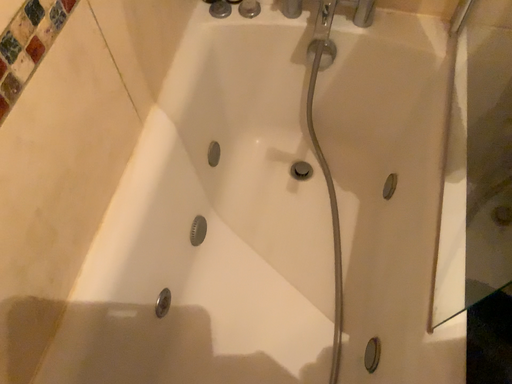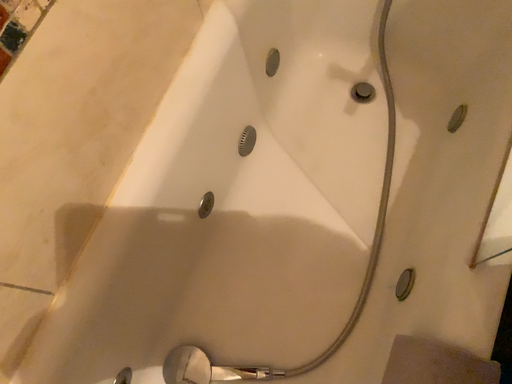
Question: Which way did the camera rotate in the video?

Choices:
 (A) rotated right
 (B) rotated left

Answer: (B)